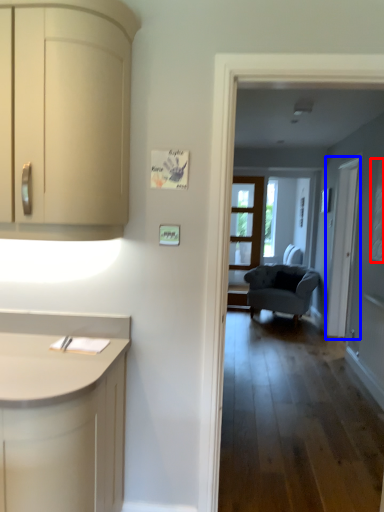
Question: Which point is further to the camera, window (highlighted by a red box) or screen door (highlighted by a blue box)?

Choices:
 (A) window
 (B) screen door

Answer: (B)